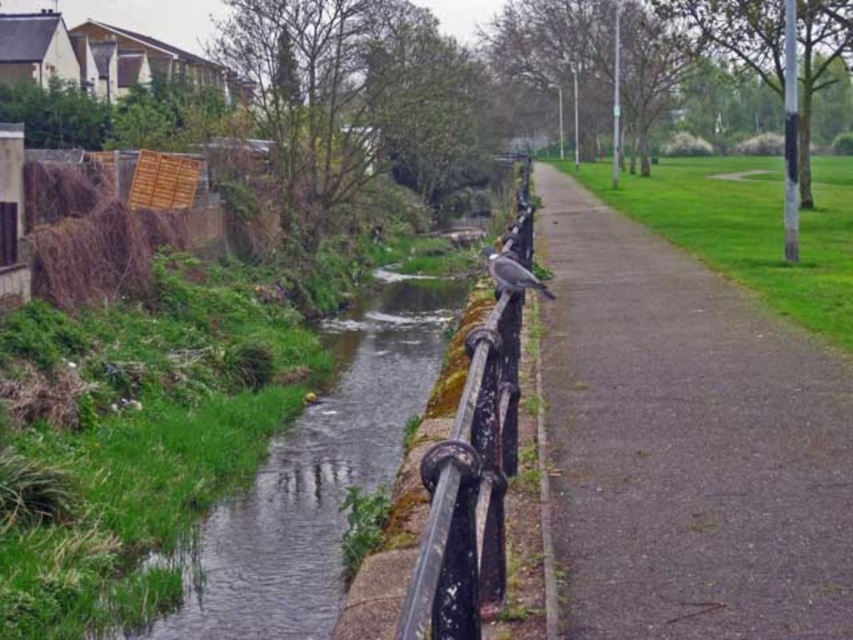
Question: Can you confirm if green mossy water at center is positioned to the left of gray matte bird at center?

Choices:
 (A) yes
 (B) no

Answer: (A)

Question: Can you confirm if gray asphalt pavement at center is positioned above green mossy water at center?

Choices:
 (A) no
 (B) yes

Answer: (B)

Question: Which is nearer to the green mossy water at center?

Choices:
 (A) gray asphalt pavement at center
 (B) gray matte bird at center

Answer: (B)

Question: Which point is farther from the camera taking this photo?

Choices:
 (A) [x=239, y=561]
 (B) [x=514, y=259]

Answer: (A)

Question: Which point appears farthest from the camera in this image?

Choices:
 (A) (711, 557)
 (B) (401, 332)

Answer: (B)

Question: From the image, what is the correct spatial relationship of green mossy water at center in relation to gray matte bird at center?

Choices:
 (A) left
 (B) right

Answer: (A)